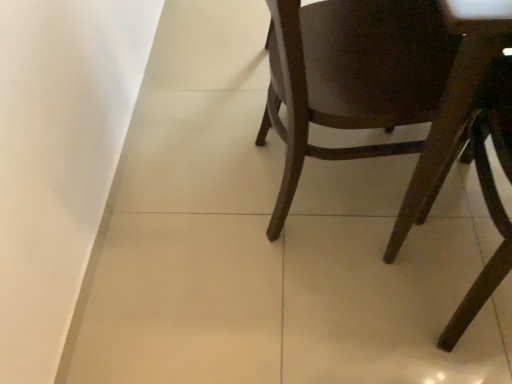
Find the location of a particular element. The height and width of the screenshot is (384, 512). free space between dark wood chair at right, acting as the second chair starting from the right, and dark wood chair at lower right, the 1th chair viewed from the right is located at coordinates (385, 268).